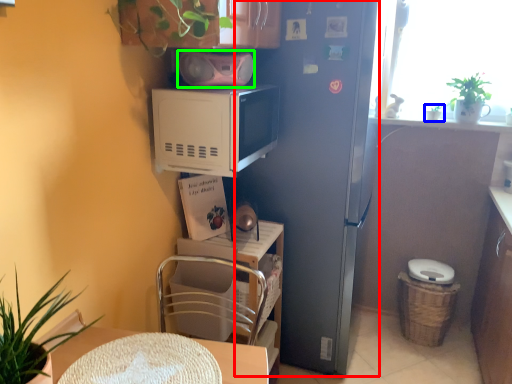
Question: Which object is the farthest from fridge (highlighted by a red box)? Choose among these: houseplant (highlighted by a blue box) or appliance (highlighted by a green box).

Choices:
 (A) houseplant
 (B) appliance

Answer: (A)